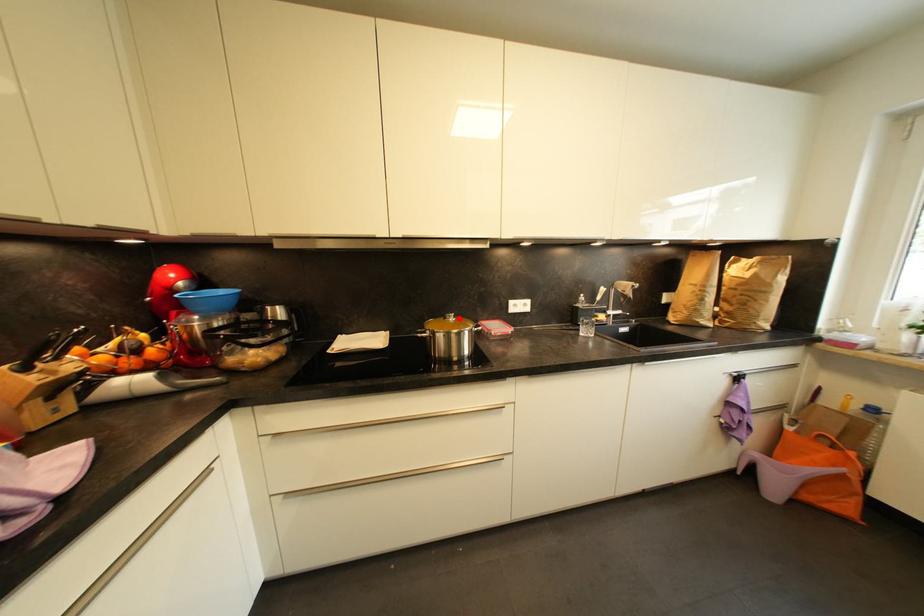
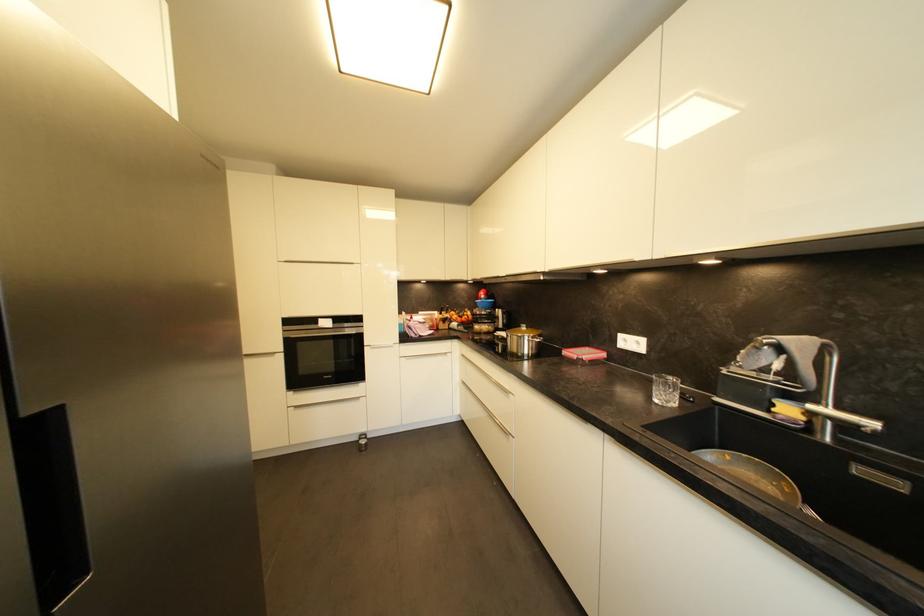
Locate, in the second image, the point that corresponds to the highlighted location in the first image.

(531, 330)